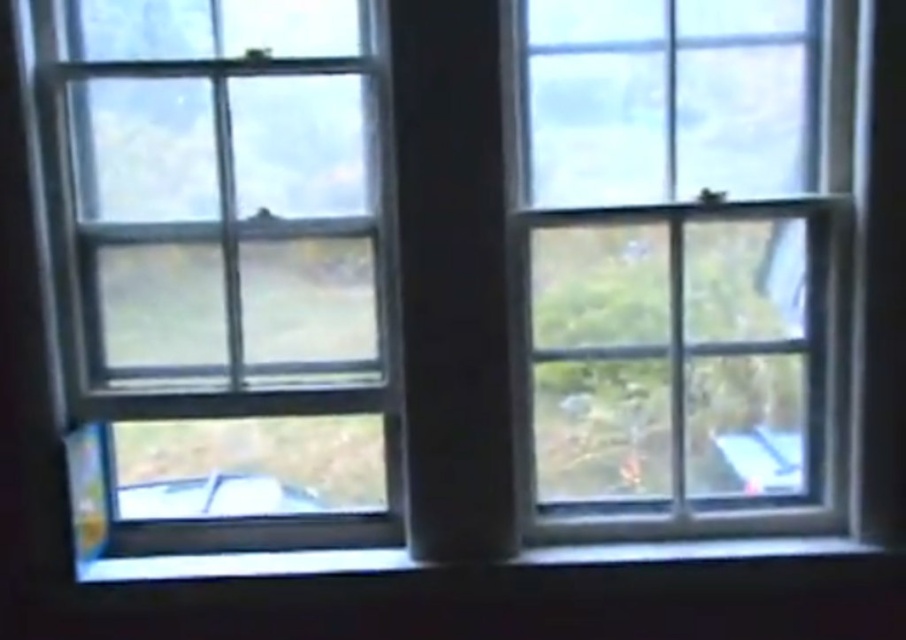
What are the coordinates of `clear glass window at left` in the screenshot? It's located at (223, 266).

Measure the distance from clear glass window at left to clear glass window at center.

20.65 inches

Which is behind, point (277, 506) or point (639, 486)?

Positioned behind is point (277, 506).

The height and width of the screenshot is (640, 906). I want to click on clear glass window at left, so click(223, 266).